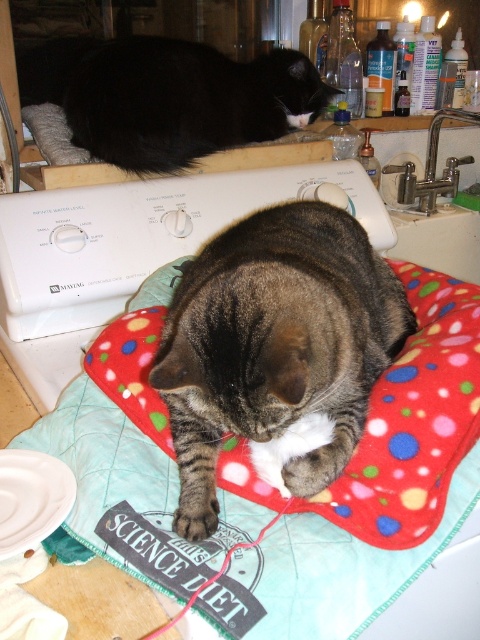
You are a cat owner who wants to ensure your cats are safe. You see the black fur cat at upper left and the brushed metal sink at upper right. Which object is closer to you from your current viewpoint?

The black fur cat at upper left is closer to you because it is positioned in front of the brushed metal sink at upper right.

You are a cat owner who wants to ensure both cats have enough space to stretch out comfortably. Given the tabby fur cat at center and the polka dot fleece pillow at center, which object is wider?

The polka dot fleece pillow at center is wider than the tabby fur cat at center.